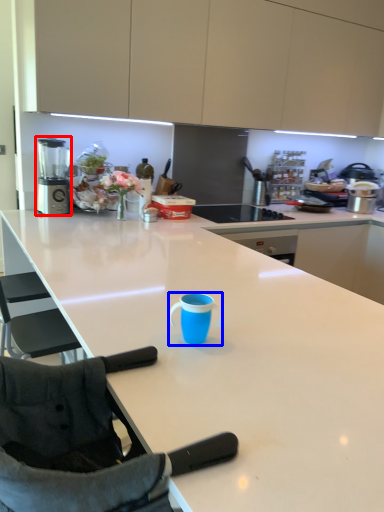
Question: Among these objects, which one is farthest to the camera, blender (highlighted by a red box) or tableware (highlighted by a blue box)?

Choices:
 (A) blender
 (B) tableware

Answer: (A)